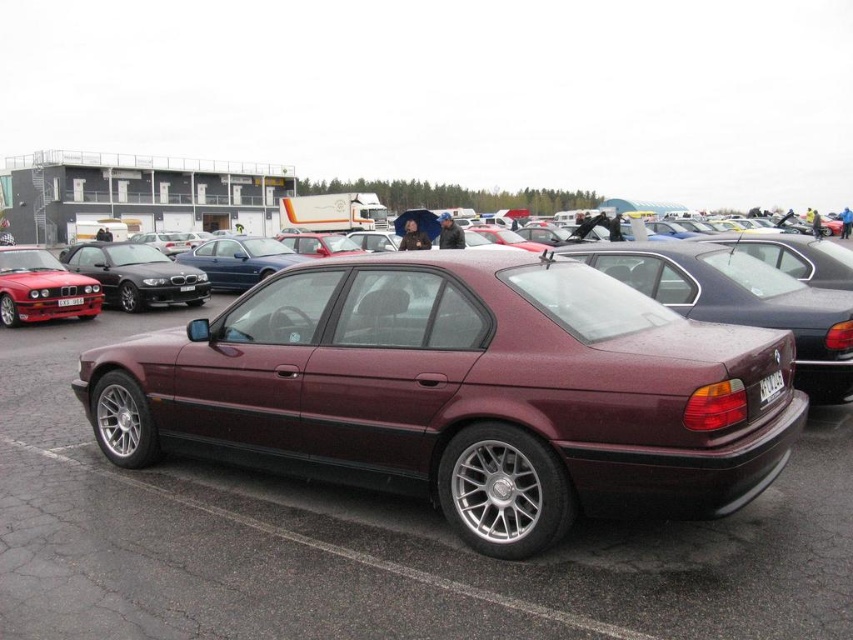
Question: Which object appears closest to the camera in this image?

Choices:
 (A) black plastic license plate at center
 (B) maroon metallic sedan at center

Answer: (B)

Question: Which point appears closest to the camera in this image?

Choices:
 (A) (776, 387)
 (B) (61, 304)

Answer: (A)

Question: Can you confirm if maroon metallic sedan at center is positioned above satin black car at left?

Choices:
 (A) no
 (B) yes

Answer: (A)

Question: Does satin black car at left have a smaller size compared to matte black sedan at left?

Choices:
 (A) no
 (B) yes

Answer: (A)

Question: Can you confirm if satin black car at left is thinner than black plastic license plate at center?

Choices:
 (A) yes
 (B) no

Answer: (B)

Question: Which point is farther to the camera?

Choices:
 (A) (115, 305)
 (B) (480, 474)
 (C) (769, 378)
 (D) (68, 298)

Answer: (A)